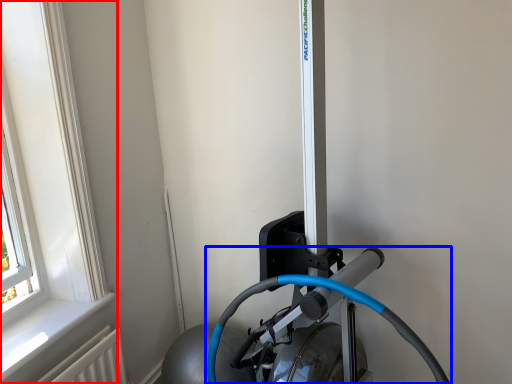
Question: Which object is further to the camera taking this photo, window (highlighted by a red box) or sport equipment (highlighted by a blue box)?

Choices:
 (A) window
 (B) sport equipment

Answer: (A)